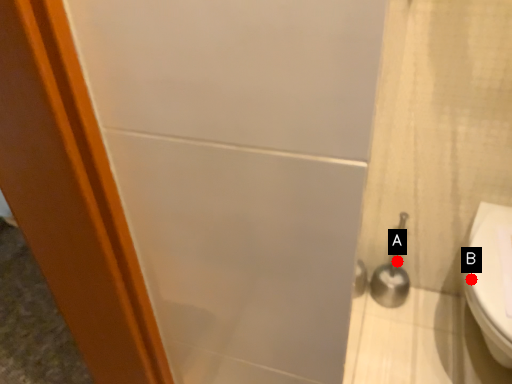
Question: Two points are circled on the image, labeled by A and B beside each circle. Which point is closer to the camera taking this photo?

Choices:
 (A) A is closer
 (B) B is closer

Answer: (B)